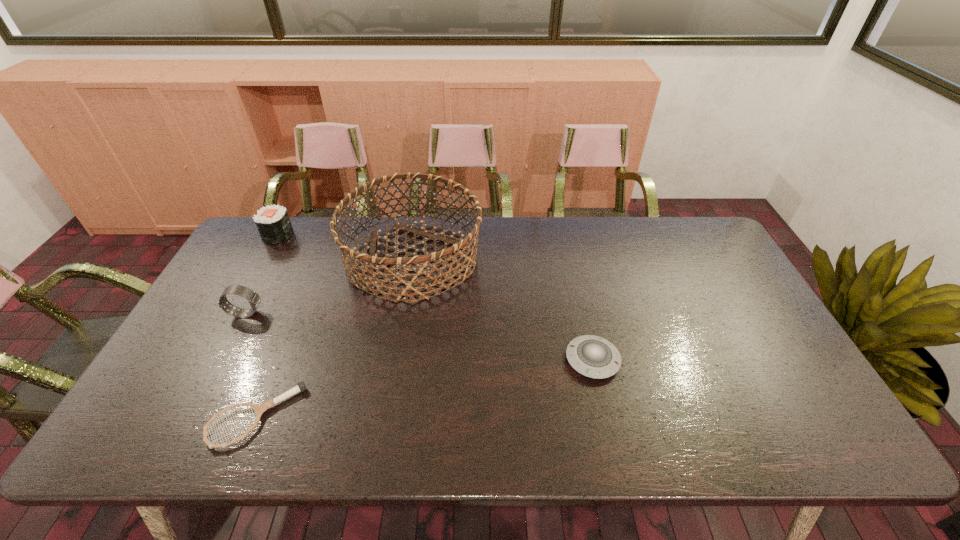
Locate an element on the screen. Image resolution: width=960 pixels, height=540 pixels. the tallest object is located at coordinates (371, 258).

Where is `sushi`? sushi is located at coordinates (273, 223).

Where is `watch`? The width and height of the screenshot is (960, 540). watch is located at coordinates (254, 299).

Locate an element on the screen. Image resolution: width=960 pixels, height=540 pixels. the second shortest object is located at coordinates (592, 356).

At what (x,y) coordinates should I click in order to perform the action: click on saucer. Please return your answer as a coordinate pair (x, y). The width and height of the screenshot is (960, 540). Looking at the image, I should click on (592, 356).

Locate an element on the screen. the nearest object is located at coordinates (259, 408).

The height and width of the screenshot is (540, 960). Find the location of `the shortest object`. the shortest object is located at coordinates (259, 408).

Where is `free space located on the left of the basket`? The width and height of the screenshot is (960, 540). free space located on the left of the basket is located at coordinates (282, 259).

Find the location of a particular element. free region located on the front of the sushi is located at coordinates (268, 254).

Locate an element on the screen. free spot located on the face of the watch is located at coordinates (374, 314).